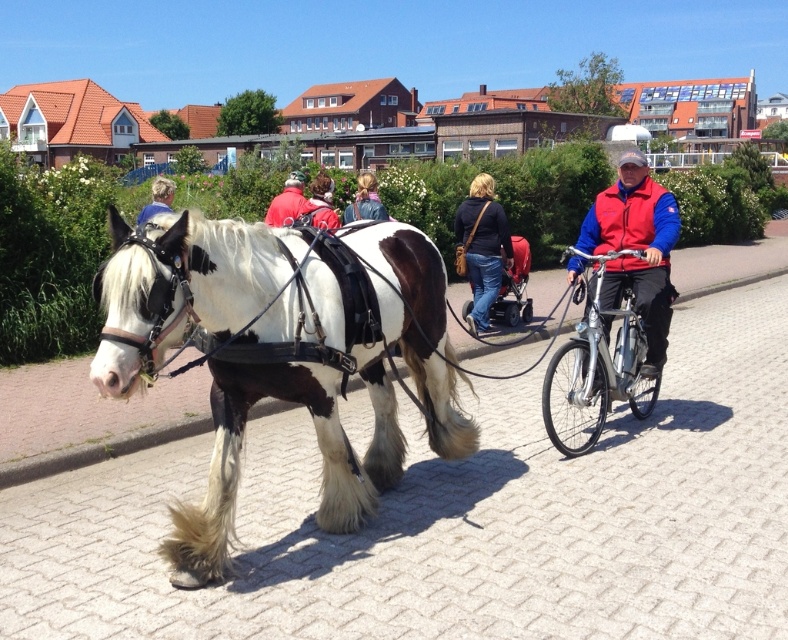
Between white and brown speckled horse at left and blonde hair at upper left, which one appears on the left side from the viewer's perspective?

blonde hair at upper left

Who is more forward, (x=310, y=314) or (x=155, y=179)?

Positioned in front is point (x=310, y=314).

Find the location of a particular element. white and brown speckled horse at left is located at coordinates (281, 352).

Who is higher up, red fleece jacket at right or silver metallic bicycle at center?

red fleece jacket at right is above.

Image resolution: width=788 pixels, height=640 pixels. Describe the element at coordinates (636, 248) in the screenshot. I see `red fleece jacket at right` at that location.

Where is `red fleece jacket at right`? Image resolution: width=788 pixels, height=640 pixels. red fleece jacket at right is located at coordinates (636, 248).

Is red fabric stroller at center closer to camera compared to light brown hair at center?

No, it is not.

Is point (511, 320) behind point (385, 218)?

Yes, it is behind point (385, 218).

Who is more distant from viewer, (495, 312) or (370, 205)?

Positioned behind is point (495, 312).

Where is `red fabric stroller at center`? red fabric stroller at center is located at coordinates (513, 285).